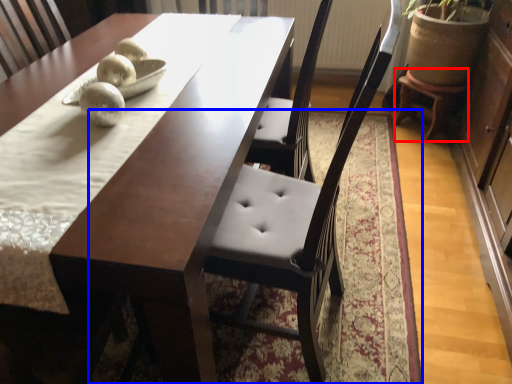
Question: Which point is further to the camera, stool (highlighted by a red box) or mat (highlighted by a blue box)?

Choices:
 (A) stool
 (B) mat

Answer: (A)